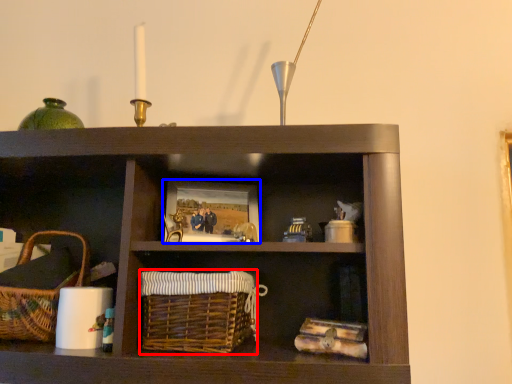
Question: Which point is further to the camera, basket (highlighted by a red box) or picture frame (highlighted by a blue box)?

Choices:
 (A) basket
 (B) picture frame

Answer: (B)